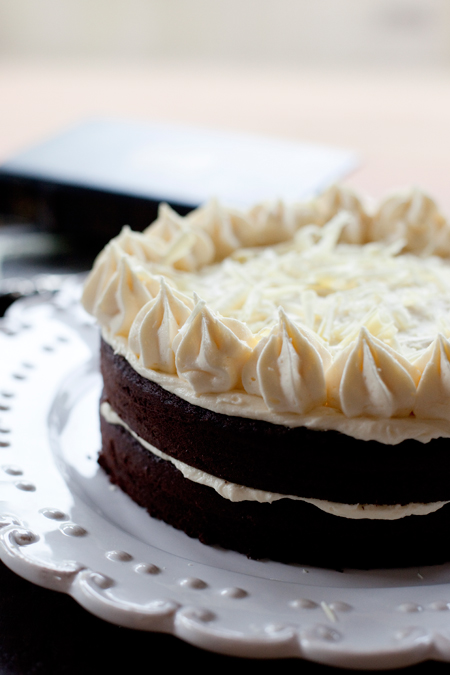
Identify the location of black table. This screenshot has height=675, width=450. (60, 645).